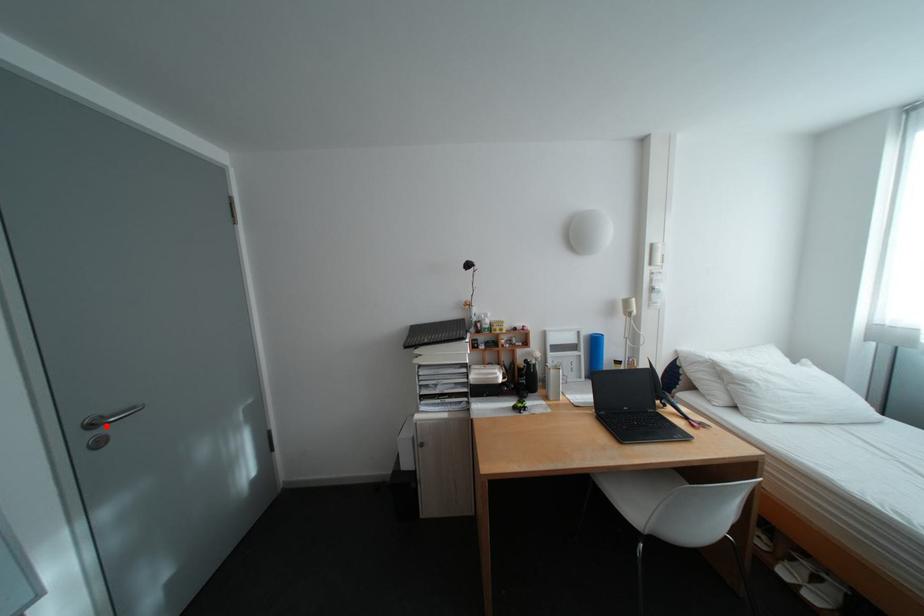
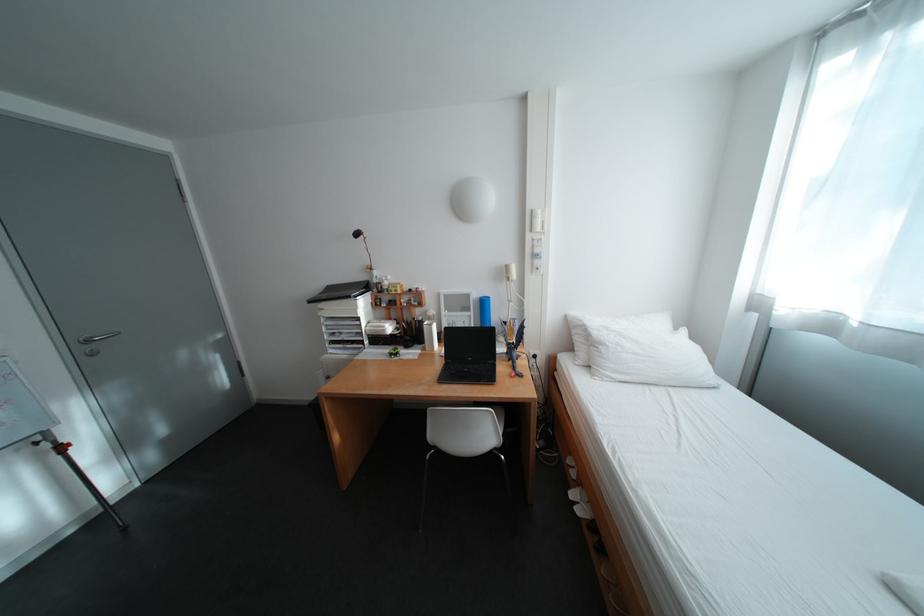
Question: I am providing you with two images of the same scene from different viewpoints. Image1 has a red point marked. In image2, the corresponding 3D location appears at what relative position? Reply with the corresponding letter.

Choices:
 (A) Closer
 (B) Farther

Answer: (B)